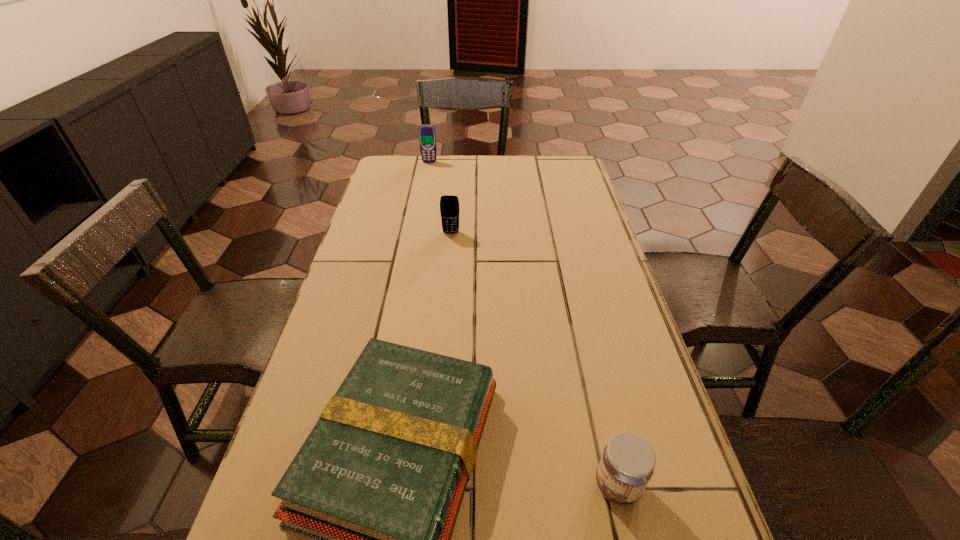
You are a GUI agent. You are given a task and a screenshot of the screen. Output one action in this format:
    pyautogui.click(x=<x>, y=<y>)
    Task: Click on the free space between the nearer cellular telephone and the jam
    The width and height of the screenshot is (960, 540).
    Given the screenshot: What is the action you would take?
    pyautogui.click(x=534, y=359)

You are a GUI agent. You are given a task and a screenshot of the screen. Output one action in this format:
    pyautogui.click(x=<x>, y=<y>)
    Task: Click on the free space between the nearer cellular telephone and the farthest object
    The width and height of the screenshot is (960, 540).
    Given the screenshot: What is the action you would take?
    pyautogui.click(x=441, y=198)

In order to click on vacant point located between the jam and the farther cellular telephone in this screenshot , I will do `click(523, 324)`.

This screenshot has width=960, height=540. Find the location of `vacant area that lies between the farthest object and the nearer cellular telephone`. vacant area that lies between the farthest object and the nearer cellular telephone is located at coordinates (441, 198).

The image size is (960, 540). Find the location of `vacant space in between the right cellular telephone and the rightmost object`. vacant space in between the right cellular telephone and the rightmost object is located at coordinates (534, 359).

The width and height of the screenshot is (960, 540). In order to click on object that is the closest to the left cellular telephone in this screenshot , I will do `click(449, 204)`.

Point out which object is positioned as the second nearest to the left cellular telephone. Please provide its 2D coordinates. Your answer should be formatted as a tuple, i.e. [(x, y)], where the tuple contains the x and y coordinates of a point satisfying the conditions above.

[(379, 482)]